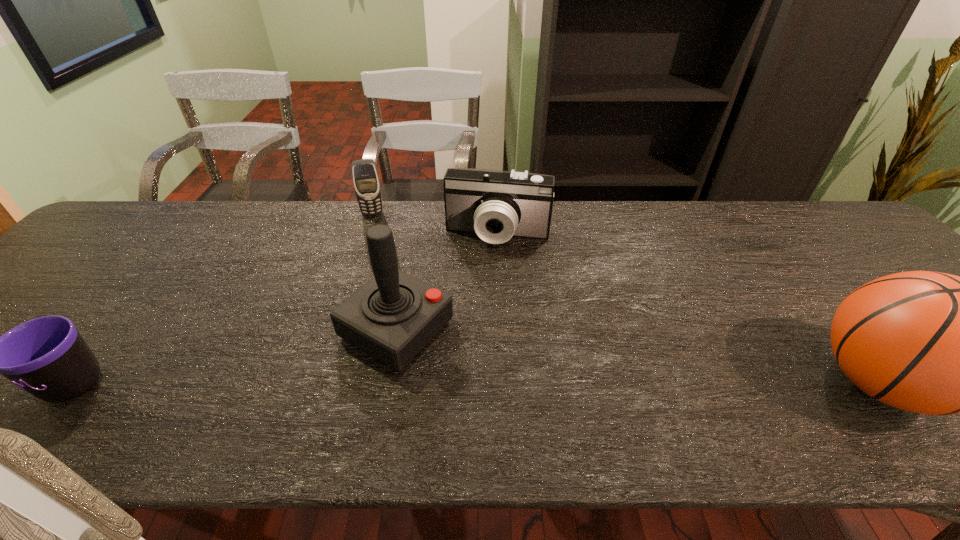
Locate an element on the screen. Image resolution: width=960 pixels, height=540 pixels. vacant spot on the desktop that is between the leftmost object and the rightmost object and is positioned on the base of the joystick is located at coordinates (496, 383).

Image resolution: width=960 pixels, height=540 pixels. Identify the location of free space on the desktop that is between the mug and the basketball and is positioned on the front face of the farthest object. (390, 383).

Where is `free space on the desktop that is between the shortest object and the rightmost object and is positioned on the lens of the second farthest object`? The image size is (960, 540). free space on the desktop that is between the shortest object and the rightmost object and is positioned on the lens of the second farthest object is located at coordinates tap(468, 383).